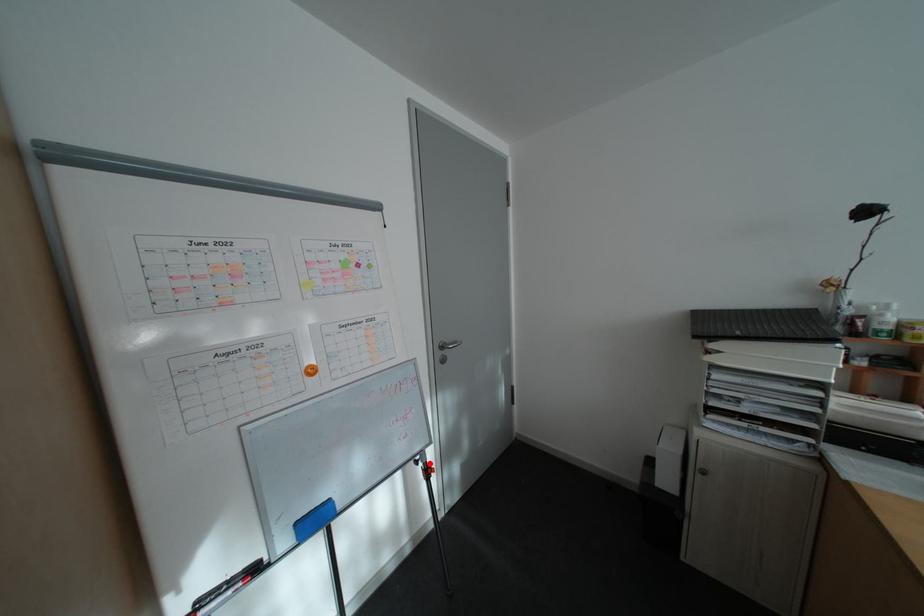
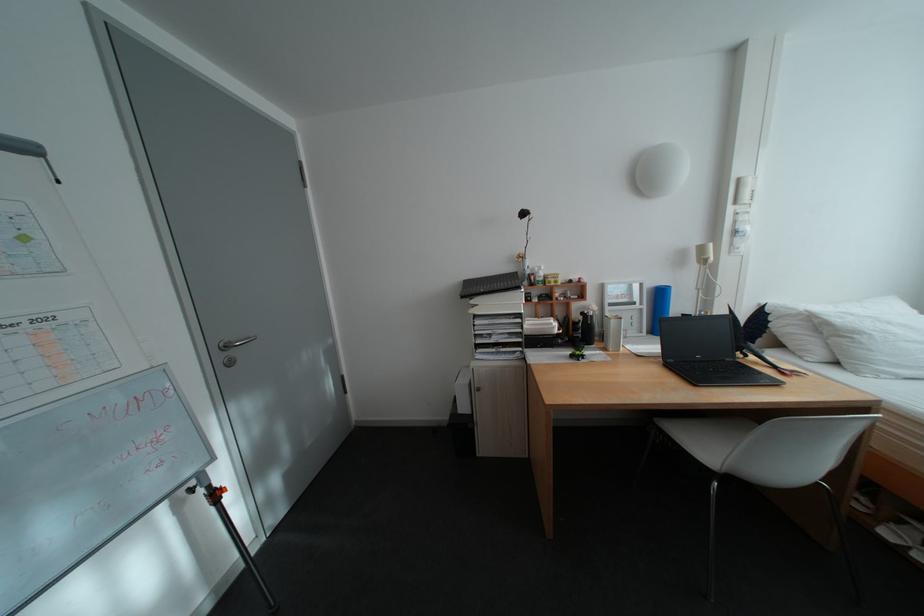
Locate, in the second image, the point that corresponds to the highlighted location in the first image.

(203, 492)